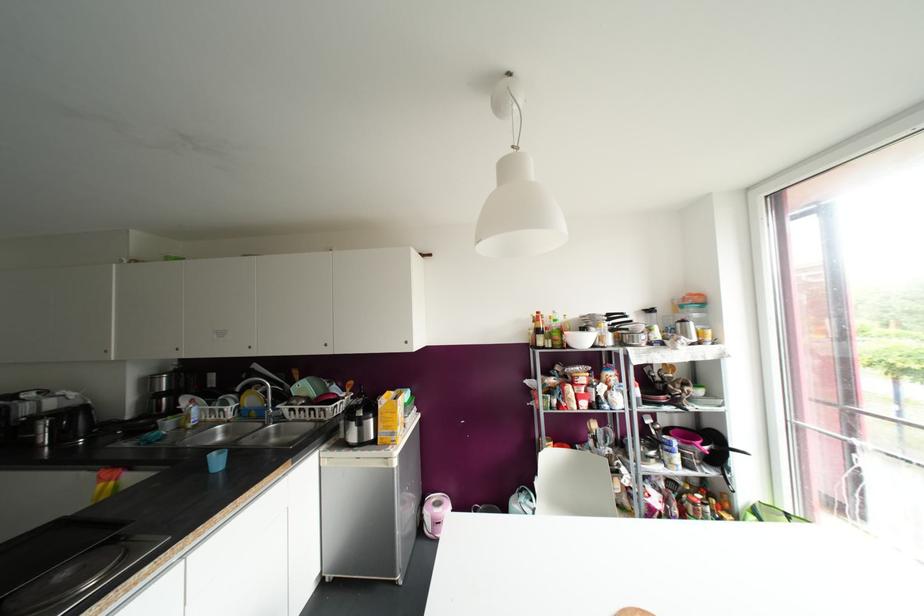
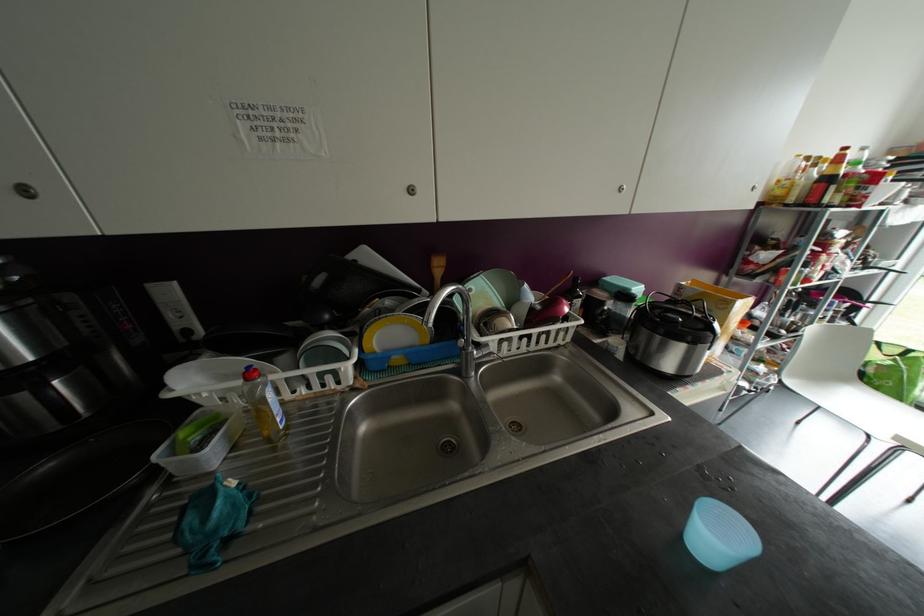
Where in the second image is the point corresponding to (195,426) from the first image?

(286, 427)